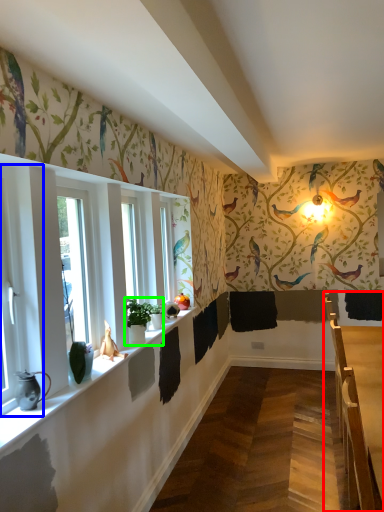
Question: Considering the real-world distances, which object is farthest from table (highlighted by a red box)? window (highlighted by a blue box) or houseplant (highlighted by a green box)?

Choices:
 (A) window
 (B) houseplant

Answer: (A)